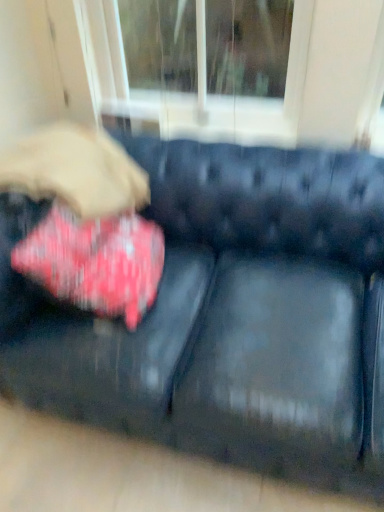
Question: Is red velvet cushion at left wider than black leather couch at center?

Choices:
 (A) yes
 (B) no

Answer: (B)

Question: Considering the relative sizes of red velvet cushion at left and black leather couch at center in the image provided, is red velvet cushion at left shorter than black leather couch at center?

Choices:
 (A) yes
 (B) no

Answer: (A)

Question: From a real-world perspective, is red velvet cushion at left on top of black leather couch at center?

Choices:
 (A) yes
 (B) no

Answer: (A)

Question: Is red velvet cushion at left far away from black leather couch at center?

Choices:
 (A) yes
 (B) no

Answer: (B)

Question: Does red velvet cushion at left have a lesser width compared to black leather couch at center?

Choices:
 (A) yes
 (B) no

Answer: (A)

Question: Is red velvet cushion at left positioned behind black leather couch at center?

Choices:
 (A) yes
 (B) no

Answer: (A)

Question: From the image's perspective, is black leather couch at center below red velvet cushion at left?

Choices:
 (A) yes
 (B) no

Answer: (A)

Question: Can you confirm if black leather couch at center is positioned to the left of red velvet cushion at left?

Choices:
 (A) no
 (B) yes

Answer: (A)

Question: Is black leather couch at center shorter than red velvet cushion at left?

Choices:
 (A) no
 (B) yes

Answer: (A)

Question: Can you confirm if black leather couch at center is thinner than red velvet cushion at left?

Choices:
 (A) no
 (B) yes

Answer: (A)

Question: Can you confirm if black leather couch at center is wider than red velvet cushion at left?

Choices:
 (A) no
 (B) yes

Answer: (B)

Question: Considering the relative sizes of black leather couch at center and red velvet cushion at left in the image provided, is black leather couch at center taller than red velvet cushion at left?

Choices:
 (A) yes
 (B) no

Answer: (A)

Question: In terms of size, does red velvet cushion at left appear bigger or smaller than black leather couch at center?

Choices:
 (A) big
 (B) small

Answer: (B)